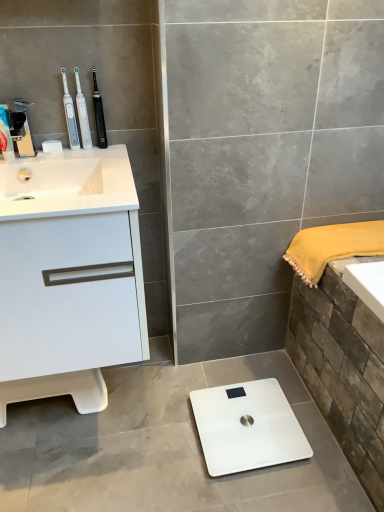
This screenshot has width=384, height=512. Identify the location of free spot to the right of brushed metal faucet at upper left, the 1th toiletry positioned from the right. (67, 162).